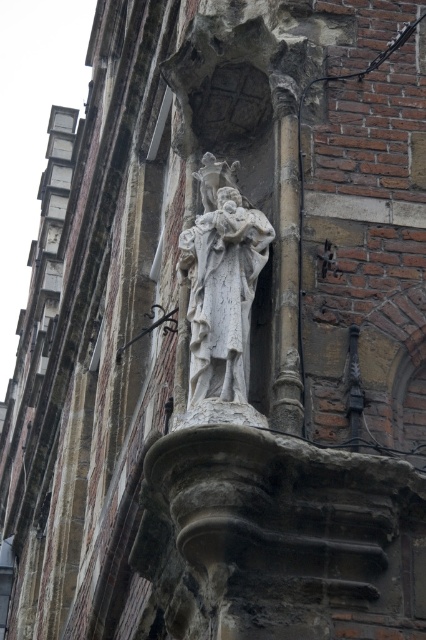
Who is more forward, (187, 240) or (282, 362)?

Positioned in front is point (282, 362).

Can you confirm if white stone statue at center is positioned to the right of stone column at center?

In fact, white stone statue at center is to the left of stone column at center.

The image size is (426, 640). Identify the location of white stone statue at center. (221, 292).

From the picture: Is white stone statue at center to the left of polished dark wood crucifix at center from the viewer's perspective?

Incorrect, white stone statue at center is not on the left side of polished dark wood crucifix at center.

Does point (210, 400) come in front of point (167, 321)?

Yes, it is in front of point (167, 321).

Who is more distant from viewer, (201, 212) or (120, 356)?

The point (120, 356) is more distant.

At what (x,y) coordinates should I click in order to perform the action: click on white stone statue at center. Please return your answer as a coordinate pair (x, y). Looking at the image, I should click on (221, 292).

Based on the photo, who is taller, stone column at center or polished dark wood crucifix at center?

With more height is stone column at center.

Looking at this image, who is positioned more to the right, stone column at center or polished dark wood crucifix at center?

stone column at center is more to the right.

The width and height of the screenshot is (426, 640). In order to click on stone column at center in this screenshot , I will do `click(287, 260)`.

Locate an element on the screen. stone column at center is located at coordinates (287, 260).